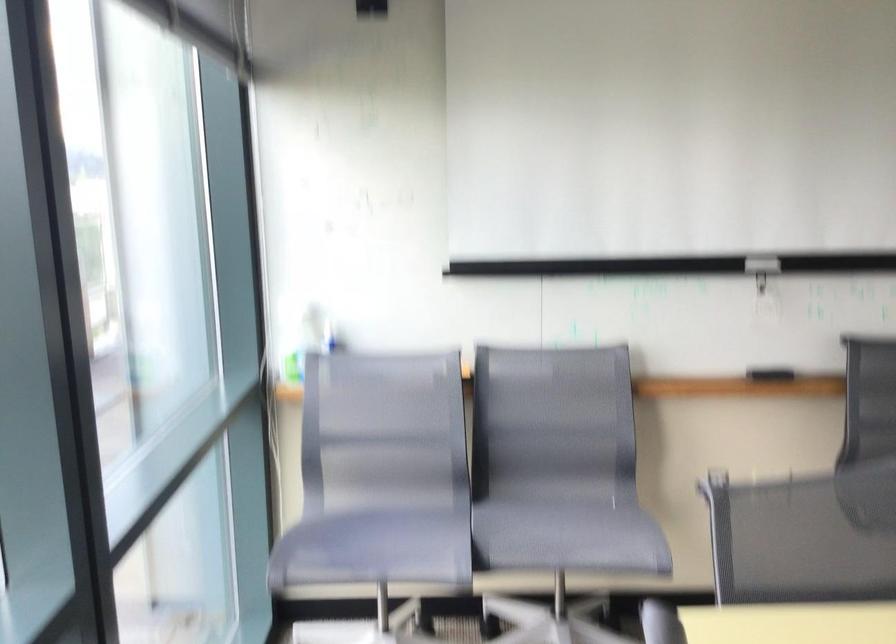
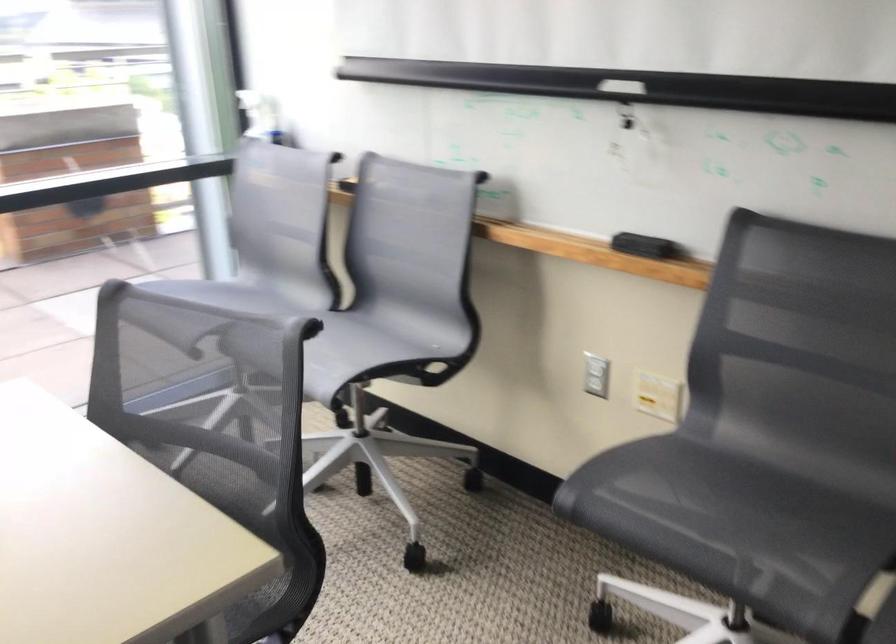
Find the pixel in the second image that matches pixel 298 325 in the first image.

(260, 116)